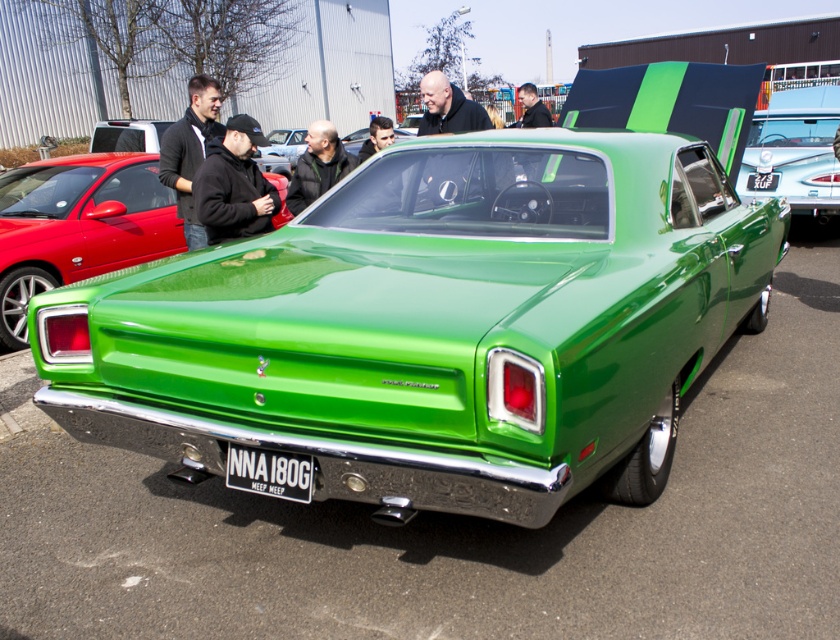
Between green glossy car at center and black fleece jacket at center, which one is positioned lower?

black fleece jacket at center is below.

Consider the image. Who is higher up, green glossy car at center or black fleece jacket at center?

green glossy car at center

Who is more distant from viewer, (x=828, y=182) or (x=245, y=122)?

Positioned behind is point (x=828, y=182).

At what (x,y) coordinates should I click in order to perform the action: click on green glossy car at center. Please return your answer as a coordinate pair (x, y). Image resolution: width=840 pixels, height=640 pixels. Looking at the image, I should click on 794,150.

Is black metal license plate at center to the right of smooth black hair at center from the viewer's perspective?

Yes, black metal license plate at center is to the right of smooth black hair at center.

Can you confirm if black metal license plate at center is positioned to the left of smooth black hair at center?

Incorrect, black metal license plate at center is not on the left side of smooth black hair at center.

Does point (260, 476) lie behind point (381, 116)?

No, (260, 476) is closer to viewer.

This screenshot has width=840, height=640. Identify the location of black metal license plate at center. (269, 472).

Does matte black jacket at upper left appear on the right side of smooth black hair at center?

In fact, matte black jacket at upper left is to the left of smooth black hair at center.

The height and width of the screenshot is (640, 840). Describe the element at coordinates (190, 150) in the screenshot. I see `matte black jacket at upper left` at that location.

What do you see at coordinates (190, 150) in the screenshot? I see `matte black jacket at upper left` at bounding box center [190, 150].

Locate an element on the screen. The height and width of the screenshot is (640, 840). matte black jacket at upper left is located at coordinates (190, 150).